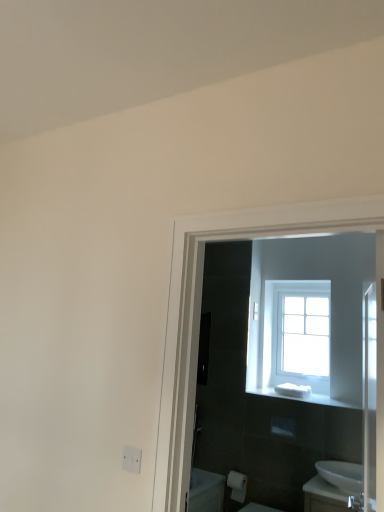
Question: Is point (340, 477) closer or farther from the camera than point (322, 403)?

Choices:
 (A) closer
 (B) farther

Answer: (A)

Question: Is white glossy sink at lower right in front of or behind white plastic soap at center in the image?

Choices:
 (A) front
 (B) behind

Answer: (A)

Question: Based on their relative distances, which object is farther from the white plastic soap at center?

Choices:
 (A) white glossy sink at lower right
 (B) white matte electric outlet at lower left
 (C) white matte toilet paper at lower center
 (D) clear glass window at upper center

Answer: (B)

Question: Which of these objects is positioned farthest from the white matte toilet paper at lower center?

Choices:
 (A) white plastic soap at center
 (B) white matte electric outlet at lower left
 (C) clear glass window at upper center
 (D) white glossy sink at lower right

Answer: (B)